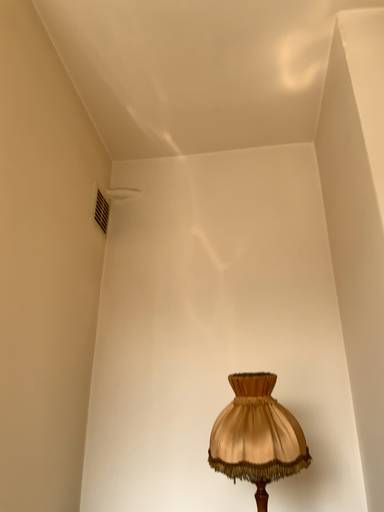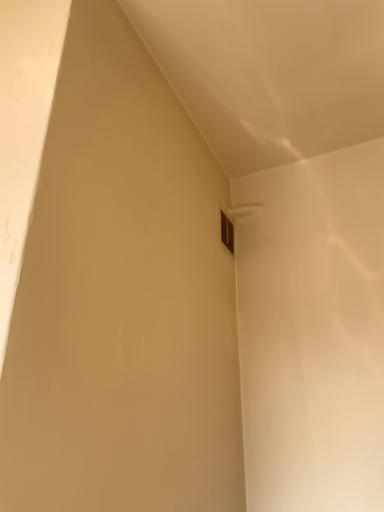
Question: Which way did the camera rotate in the video?

Choices:
 (A) rotated right
 (B) rotated left

Answer: (B)